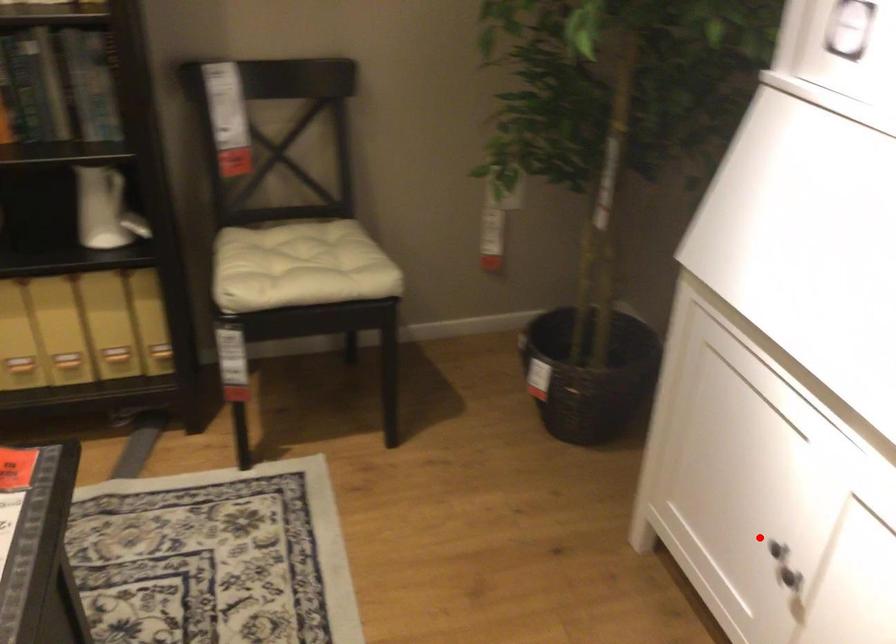
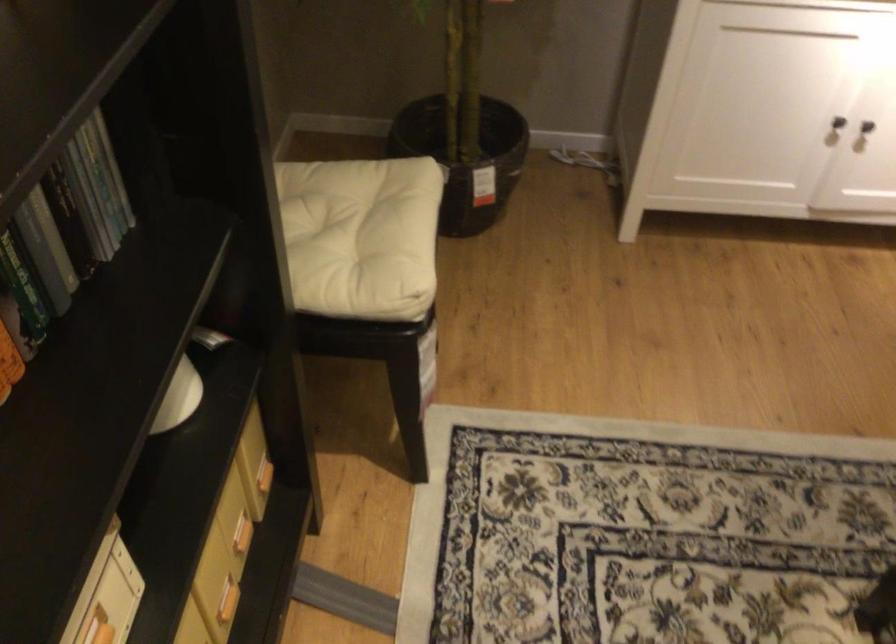
Question: I am providing you with two images of the same scene from different viewpoints. In image1, a red point is highlighted. Considering the same 3D point in image2, which of the following is correct?

Choices:
 (A) It is closer
 (B) It is farther

Answer: (B)